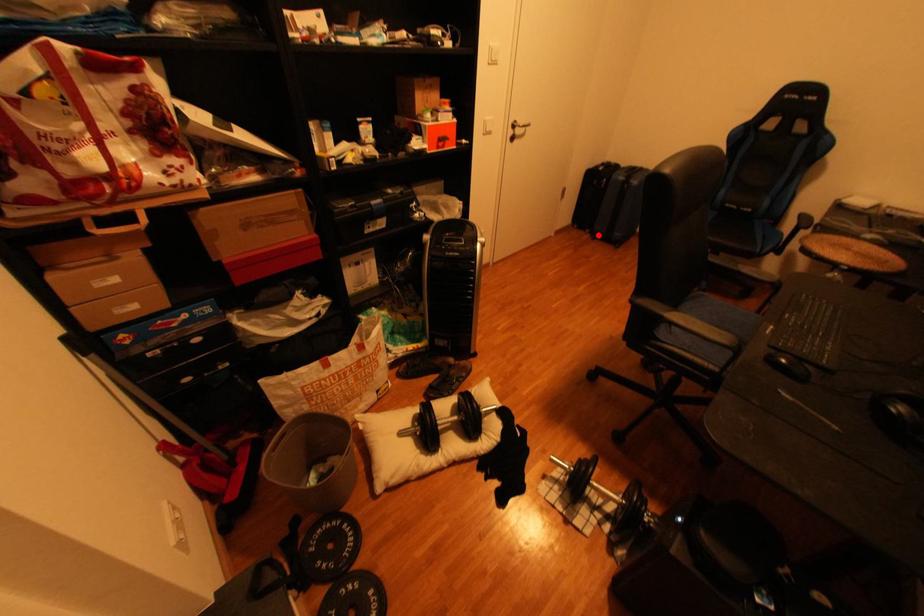
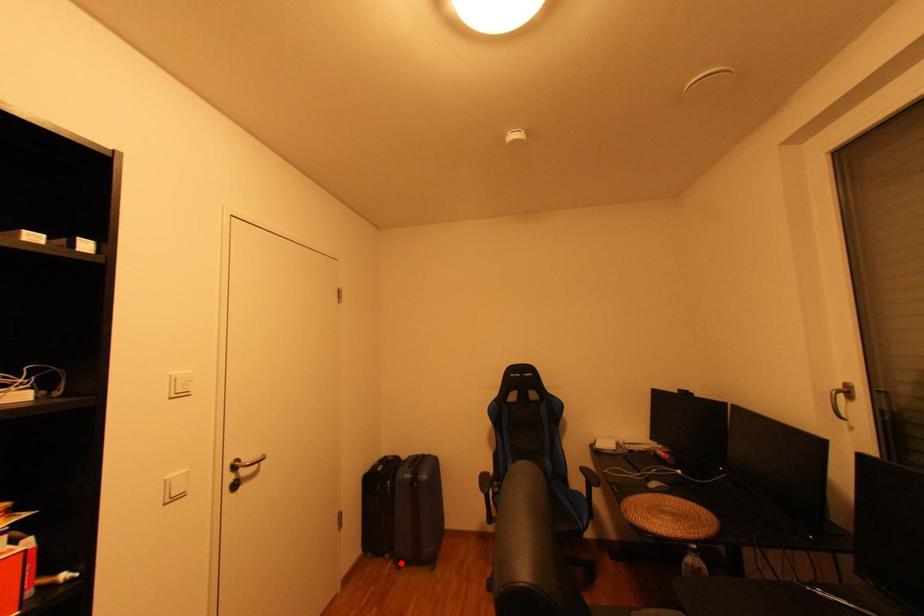
I am providing you with two images of the same scene from different viewpoints. A red point is marked on the first image and another point is marked on the second image. Does the point marked in image1 correspond to the same location as the one in image2?

Yes